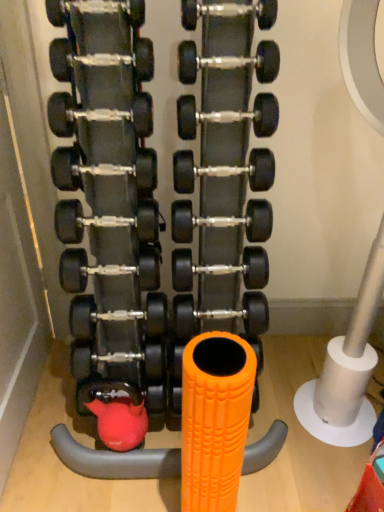
Question: Is black rubber dumbbell at center, which is the 5th dumbbell in bottom-to-top order, outside black rubber dumbbell at center, the twelfth dumbbell positioned from the top?

Choices:
 (A) no
 (B) yes

Answer: (B)

Question: Is black rubber dumbbell at center, arranged as the eleventh dumbbell when viewed from the top, beside black rubber dumbbell at center, acting as the 4th dumbbell starting from the bottom?

Choices:
 (A) yes
 (B) no

Answer: (B)

Question: From a real-world perspective, is black rubber dumbbell at center, which is the 5th dumbbell in bottom-to-top order, on top of black rubber dumbbell at center, the twelfth dumbbell positioned from the top?

Choices:
 (A) yes
 (B) no

Answer: (A)

Question: Can you confirm if black rubber dumbbell at center, which is the 5th dumbbell in bottom-to-top order, is positioned to the right of black rubber dumbbell at center, the twelfth dumbbell positioned from the top?

Choices:
 (A) yes
 (B) no

Answer: (A)

Question: Is black rubber dumbbell at center, which is the 5th dumbbell in bottom-to-top order, surrounding black rubber dumbbell at center, the twelfth dumbbell positioned from the top?

Choices:
 (A) no
 (B) yes

Answer: (A)

Question: Is black rubber dumbbell at center, the 10th dumbbell ordered from the bottom, situated inside black rubber dumbbell at center, which is the 3th dumbbell from bottom to top, or outside?

Choices:
 (A) inside
 (B) outside

Answer: (B)

Question: Considering the positions of black rubber dumbbell at center, the 6th dumbbell when ordered from top to bottom, and black rubber dumbbell at center, which is the 3th dumbbell from bottom to top, in the image, is black rubber dumbbell at center, the 6th dumbbell when ordered from top to bottom, taller or shorter than black rubber dumbbell at center, which is the 3th dumbbell from bottom to top,?

Choices:
 (A) tall
 (B) short

Answer: (B)

Question: From the image's perspective, is black rubber dumbbell at center, the 6th dumbbell when ordered from top to bottom, positioned above or below black rubber dumbbell at center, which is the thirteenth dumbbell from top to bottom?

Choices:
 (A) above
 (B) below

Answer: (A)

Question: Considering the positions of point (150, 120) and point (258, 308), is point (150, 120) closer or farther from the camera than point (258, 308)?

Choices:
 (A) closer
 (B) farther

Answer: (A)

Question: Considering their positions, is black rubber dumbbell at center, placed as the third dumbbell when sorted from top to bottom, located in front of or behind matte black dumbbell at upper center, the fourteenth dumbbell positioned from the bottom?

Choices:
 (A) behind
 (B) front

Answer: (A)

Question: From the image's perspective, is black rubber dumbbell at center, placed as the third dumbbell when sorted from top to bottom, above or below matte black dumbbell at upper center, the fourteenth dumbbell positioned from the bottom?

Choices:
 (A) below
 (B) above

Answer: (A)

Question: Would you say black rubber dumbbell at center, the 13th dumbbell ordered from the bottom, is to the left or to the right of matte black dumbbell at upper center, the fourteenth dumbbell positioned from the bottom, in the picture?

Choices:
 (A) left
 (B) right

Answer: (B)

Question: Is black rubber dumbbell at center, placed as the third dumbbell when sorted from top to bottom, wider or thinner than matte black dumbbell at upper center, which ranks as the 2th dumbbell in top-to-bottom order?

Choices:
 (A) thin
 (B) wide

Answer: (B)

Question: Considering the positions of orange textured foam roller at center and black rubber dumbbell at center, which is the 5th dumbbell in bottom-to-top order, in the image, is orange textured foam roller at center taller or shorter than black rubber dumbbell at center, which is the 5th dumbbell in bottom-to-top order,?

Choices:
 (A) tall
 (B) short

Answer: (A)

Question: Is point (117, 300) closer or farther from the camera than point (175, 289)?

Choices:
 (A) farther
 (B) closer

Answer: (B)